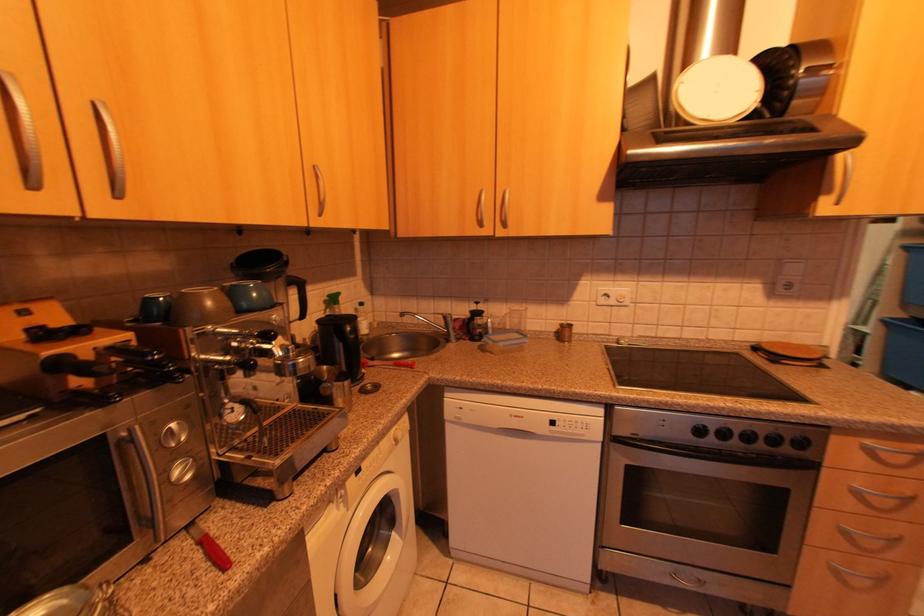
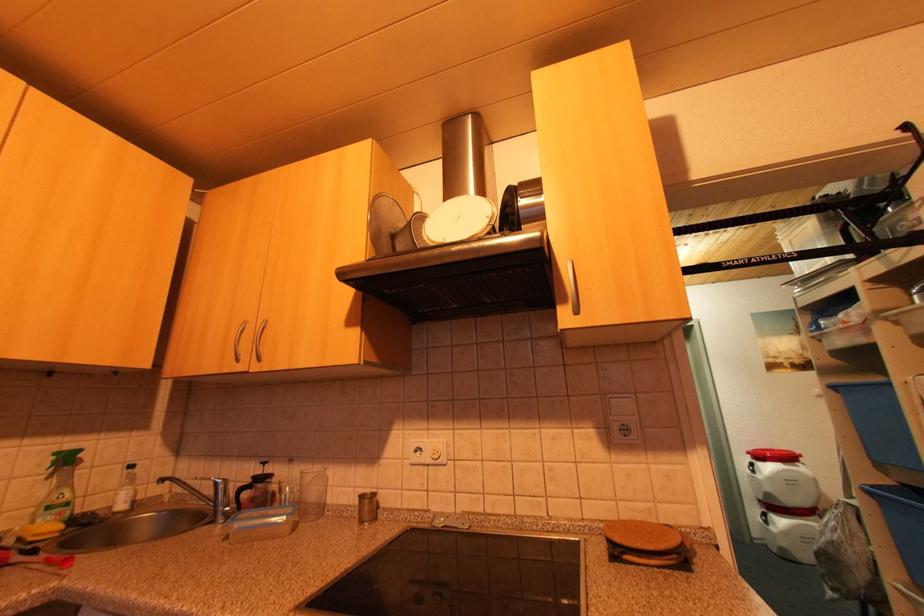
Question: Based on the continuous images, in which direction is the camera rotating? Reply with the corresponding letter.

Choices:
 (A) Left
 (B) Right
 (C) Up
 (D) Down

Answer: (C)